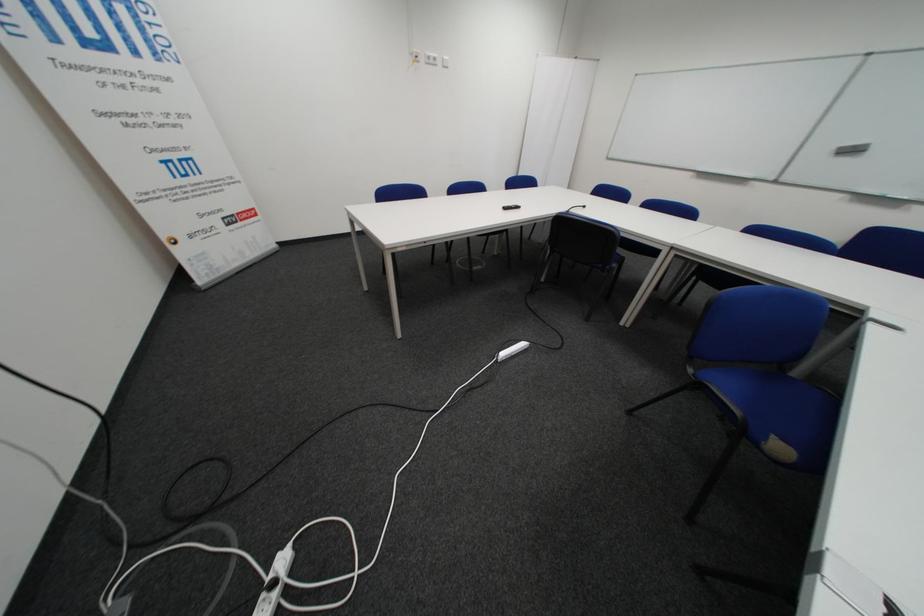
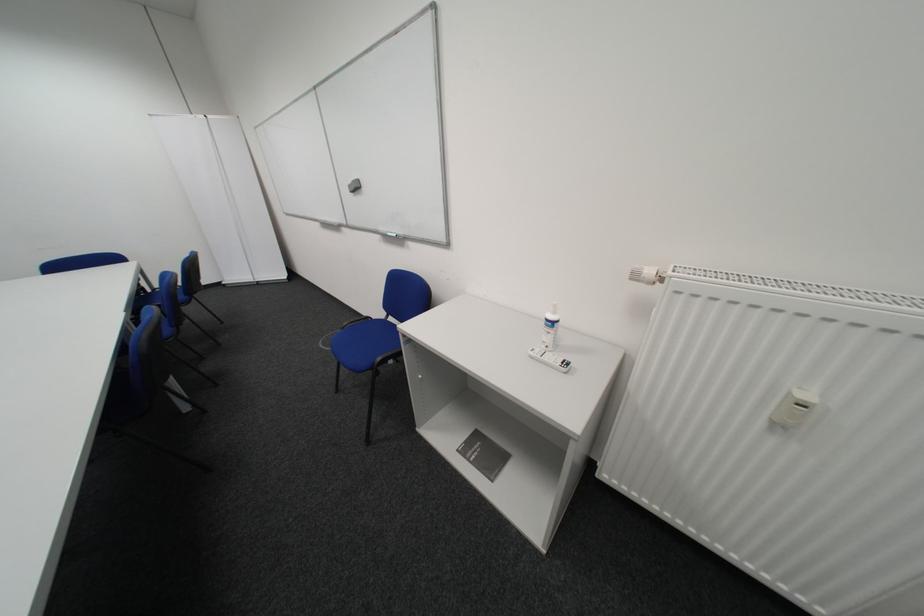
Question: The images are taken continuously from a first-person perspective. In which direction are you moving?

Choices:
 (A) Left
 (B) Right
 (C) Forward
 (D) Backward

Answer: (B)